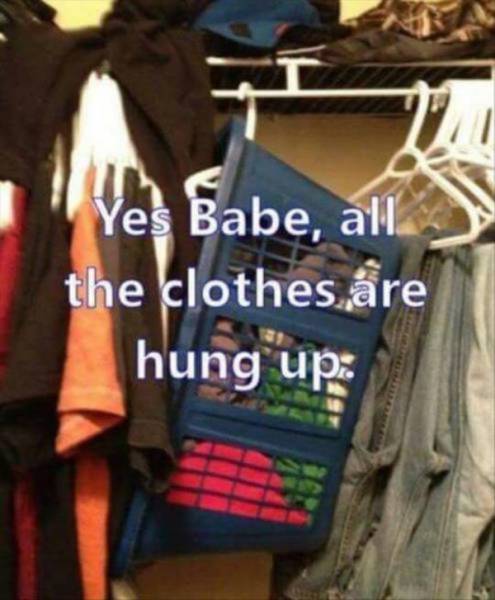
Image resolution: width=495 pixels, height=600 pixels. In order to click on clothes in basket in this screenshot , I will do `click(241, 484)`, `click(268, 378)`, `click(286, 268)`.